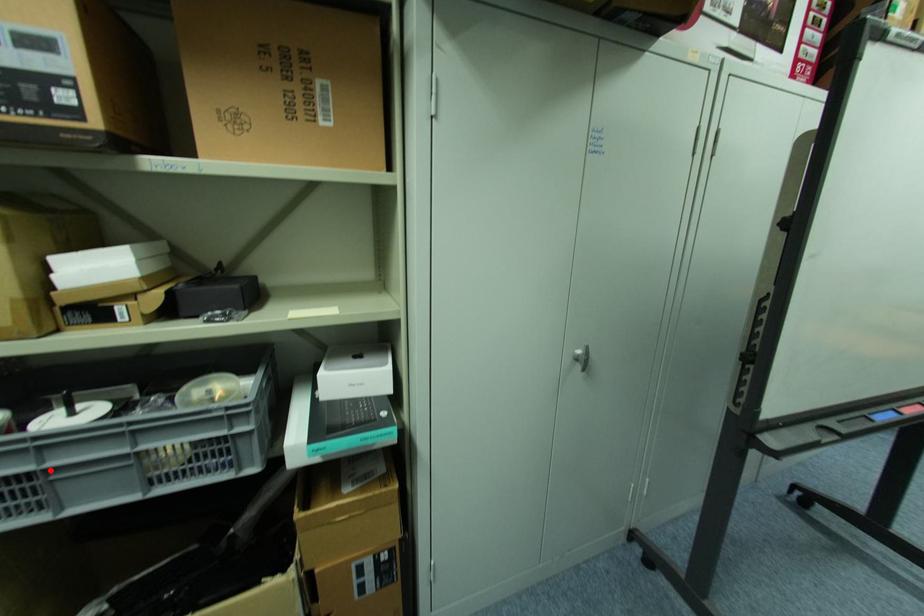
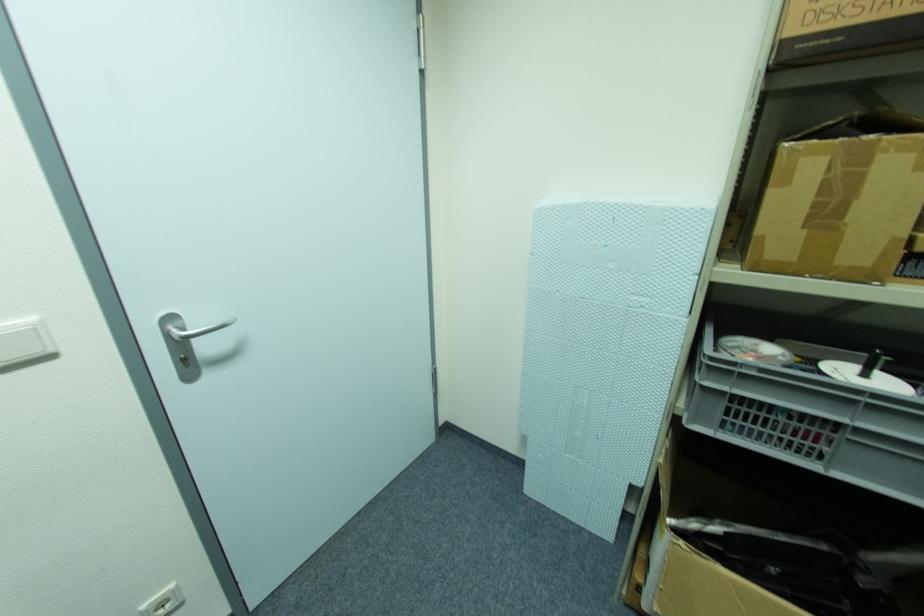
Question: I am providing you with two images of the same scene from different viewpoints. Image1 has a red point marked. In image2, the corresponding 3D location appears at what relative position? Reply with the corresponding letter.

Choices:
 (A) Closer
 (B) Farther

Answer: (B)